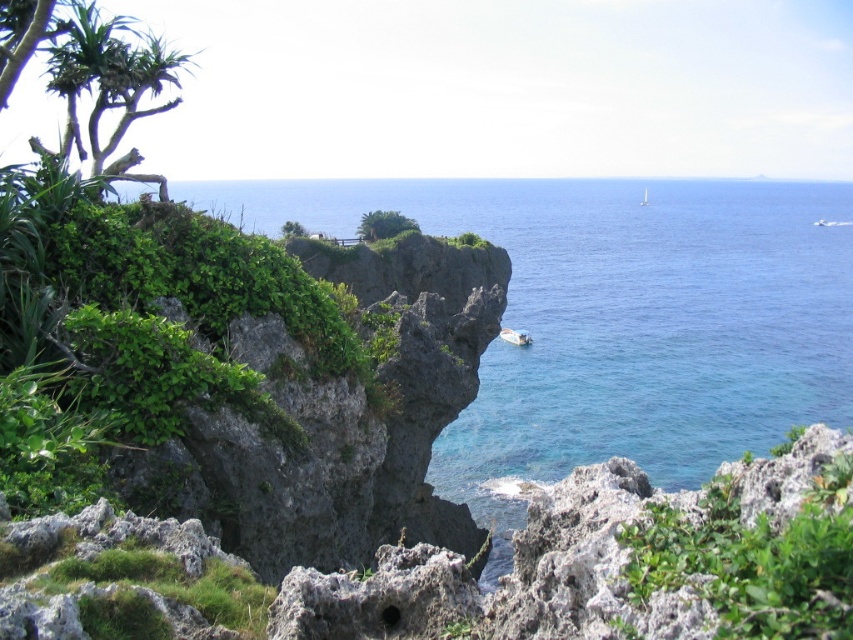
Who is more forward, (x=149, y=268) or (x=415, y=227)?

Point (x=149, y=268) is in front.

Between green leafy shrub at left and green leafy plant at center, which one has less height?

green leafy shrub at left is shorter.

Between point (141, 380) and point (393, 234), which one is positioned behind?

The point (393, 234) is behind.

Identify the location of green leafy shrub at left. The height and width of the screenshot is (640, 853). (134, 323).

Looking at this image, can you confirm if clear blue water at center is smaller than green leafy shrub at left?

No, clear blue water at center is not smaller than green leafy shrub at left.

What do you see at coordinates (619, 316) in the screenshot? This screenshot has height=640, width=853. I see `clear blue water at center` at bounding box center [619, 316].

Identify the location of clear blue water at center. The height and width of the screenshot is (640, 853). (619, 316).

Is clear blue water at center to the right of white glossy boat at center from the viewer's perspective?

Correct, you'll find clear blue water at center to the right of white glossy boat at center.

Who is more forward, (490, 204) or (508, 337)?

Point (508, 337)

This screenshot has height=640, width=853. I want to click on clear blue water at center, so click(x=619, y=316).